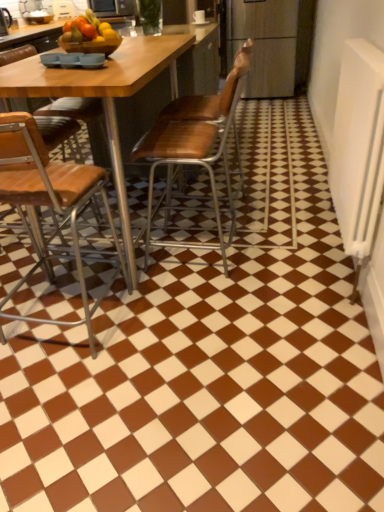
Question: From the image's perspective, would you say metallic microwave at upper center is shown under brown leather chair at left, positioned as the 1th chair in left-to-right order?

Choices:
 (A) no
 (B) yes

Answer: (A)

Question: From a real-world perspective, is metallic microwave at upper center positioned over brown leather chair at left, positioned as the 1th chair in left-to-right order, based on gravity?

Choices:
 (A) yes
 (B) no

Answer: (A)

Question: Is metallic microwave at upper center facing towards brown leather chair at left, positioned as the 1th chair in left-to-right order?

Choices:
 (A) yes
 (B) no

Answer: (A)

Question: From a real-world perspective, is metallic microwave at upper center positioned under brown leather chair at left, positioned as the 1th chair in left-to-right order, based on gravity?

Choices:
 (A) yes
 (B) no

Answer: (B)

Question: Is metallic microwave at upper center not within brown leather chair at left, positioned as the 1th chair in left-to-right order?

Choices:
 (A) yes
 (B) no

Answer: (A)

Question: Is metallic microwave at upper center wider or thinner than wooden seat at center, which is counted as the 3th chair, starting from the left?

Choices:
 (A) wide
 (B) thin

Answer: (B)

Question: From a real-world perspective, is metallic microwave at upper center physically located above or below wooden seat at center, which is counted as the 3th chair, starting from the left?

Choices:
 (A) above
 (B) below

Answer: (A)

Question: Would you say metallic microwave at upper center is inside or outside wooden seat at center, which is counted as the 3th chair, starting from the left?

Choices:
 (A) outside
 (B) inside

Answer: (A)

Question: From the image's perspective, is metallic microwave at upper center above or below wooden seat at center, which is counted as the 3th chair, starting from the left?

Choices:
 (A) above
 (B) below

Answer: (A)

Question: Relative to wooden at center, which ranks as the second chair in left-to-right order, is brown leather chair at left, positioned as the 1th chair in left-to-right order, in front or behind?

Choices:
 (A) front
 (B) behind

Answer: (A)

Question: Which is correct: brown leather chair at left, acting as the third chair starting from the right, is inside wooden at center, the 2th chair from the right, or outside of it?

Choices:
 (A) outside
 (B) inside

Answer: (A)

Question: Is brown leather chair at left, acting as the third chair starting from the right, bigger or smaller than wooden at center, which ranks as the second chair in left-to-right order?

Choices:
 (A) small
 (B) big

Answer: (B)

Question: Considering the relative positions of brown leather chair at left, acting as the third chair starting from the right, and wooden at center, which ranks as the second chair in left-to-right order, in the image provided, is brown leather chair at left, acting as the third chair starting from the right, to the left or to the right of wooden at center, which ranks as the second chair in left-to-right order,?

Choices:
 (A) right
 (B) left

Answer: (B)

Question: From their relative heights in the image, would you say brown leather chair at left, acting as the third chair starting from the right, is taller or shorter than wooden seat at center, which appears as the 1th chair when viewed from the right?

Choices:
 (A) short
 (B) tall

Answer: (B)

Question: From a real-world perspective, is brown leather chair at left, acting as the third chair starting from the right, positioned above or below wooden seat at center, which is counted as the 3th chair, starting from the left?

Choices:
 (A) above
 (B) below

Answer: (B)